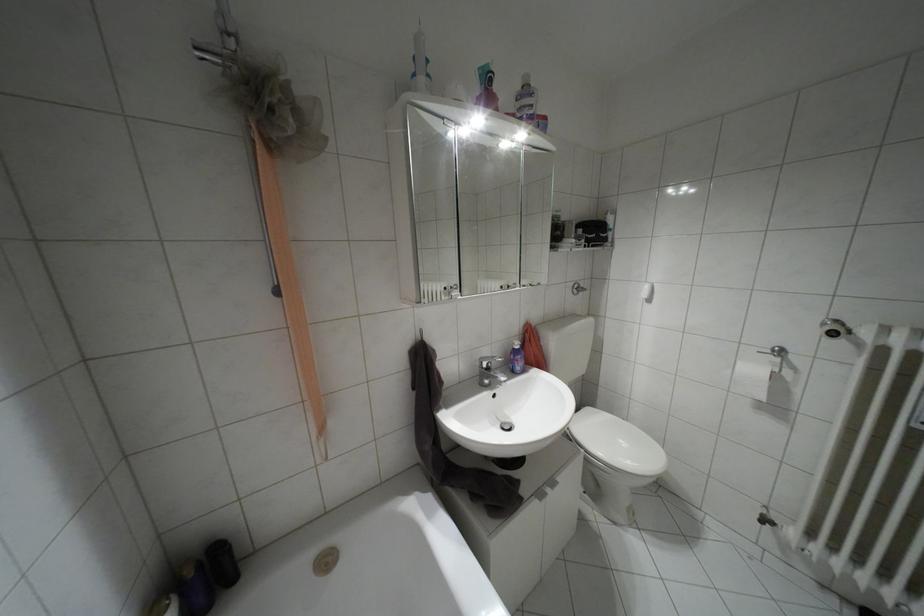
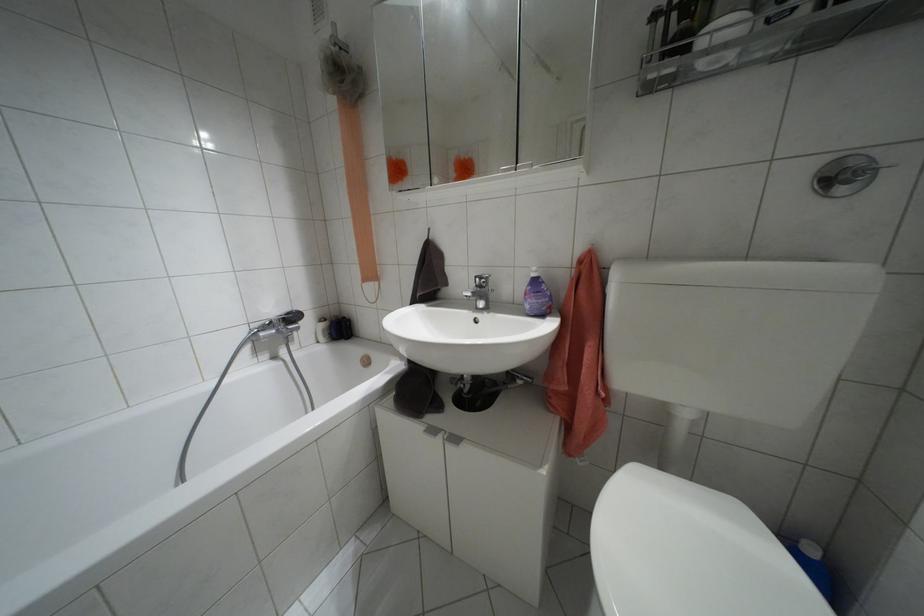
Question: I am providing you with two images of the same scene from different viewpoints. Which of the following objects are not visible in image2?

Choices:
 (A) white toilet lid
 (B) beige mesh loofah
 (C) toilet flush button
 (D) none of these

Answer: (D)